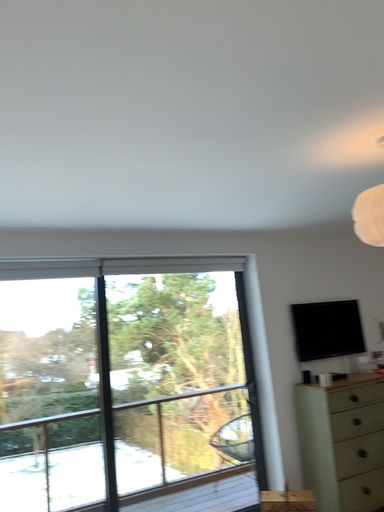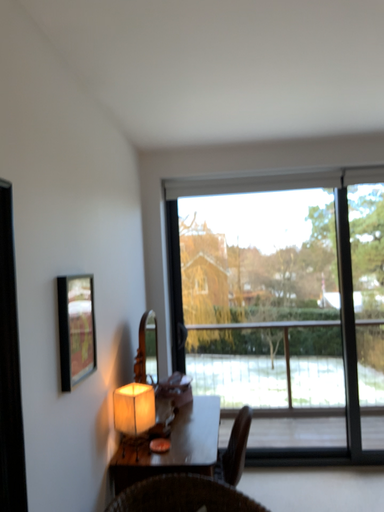
Question: How did the camera likely rotate when shooting the video?

Choices:
 (A) rotated downward
 (B) rotated upward

Answer: (A)